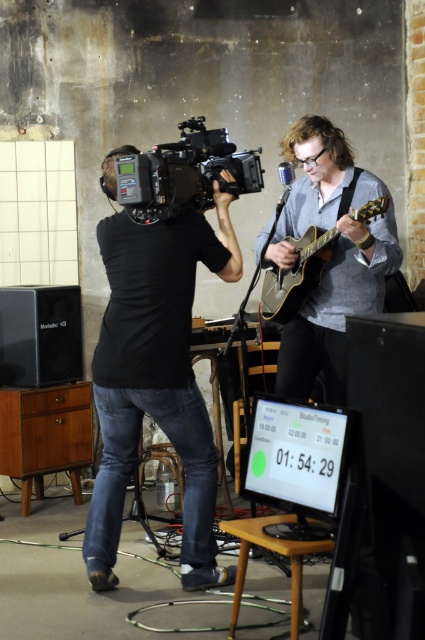
At what (x,y) coordinates should I click in order to perform the action: click on wooden acoustic guitar at center. Please return your answer as a coordinate pair (x, y). The width and height of the screenshot is (425, 640). Looking at the image, I should click on (297, 275).

Is wooden acoustic guitar at center positioned behind wooden stool at lower center?

That is True.

What do you see at coordinates (297, 275) in the screenshot? Image resolution: width=425 pixels, height=640 pixels. I see `wooden acoustic guitar at center` at bounding box center [297, 275].

Find the location of a particular element. wooden acoustic guitar at center is located at coordinates (297, 275).

Who is positioned more to the right, black matte camera at center or matte gray guitar at center?

Positioned to the right is matte gray guitar at center.

How distant is black matte camera at center from matte gray guitar at center?

A distance of 24.63 inches exists between black matte camera at center and matte gray guitar at center.

What do you see at coordinates (155, 378) in the screenshot?
I see `black matte camera at center` at bounding box center [155, 378].

The width and height of the screenshot is (425, 640). Find the location of `black matte camera at center`. black matte camera at center is located at coordinates (155, 378).

Which is above, black matte camera at center or wooden stool at lower center?

black matte camera at center is higher up.

Does black matte camera at center have a lesser width compared to wooden stool at lower center?

No.

Locate an element on the screen. black matte camera at center is located at coordinates (155, 378).

Identify the location of black matte camera at center. This screenshot has width=425, height=640. (155, 378).